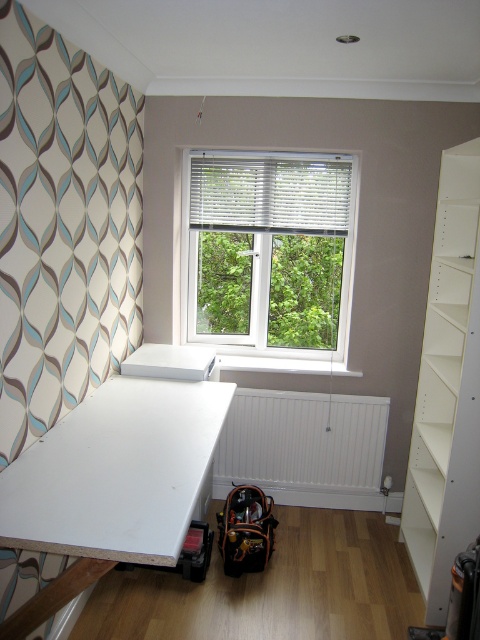
Question: Which point appears closest to the camera in this image?

Choices:
 (A) (292, 324)
 (B) (363, 468)

Answer: (B)

Question: Is white plastic window at center smaller than white matte radiator at lower center?

Choices:
 (A) no
 (B) yes

Answer: (A)

Question: Can you confirm if white plastic window at center is thinner than white matte bookshelf at right?

Choices:
 (A) no
 (B) yes

Answer: (A)

Question: Among these points, which one is farthest from the camera?

Choices:
 (A) (446, 285)
 (B) (238, 397)
 (C) (275, 157)

Answer: (B)

Question: Which of these objects is positioned farthest from the white matte bookshelf at right?

Choices:
 (A) white matte radiator at lower center
 (B) white plastic window at center

Answer: (B)

Question: From the image, what is the correct spatial relationship of white matte bookshelf at right in relation to white matte radiator at lower center?

Choices:
 (A) right
 (B) left

Answer: (A)